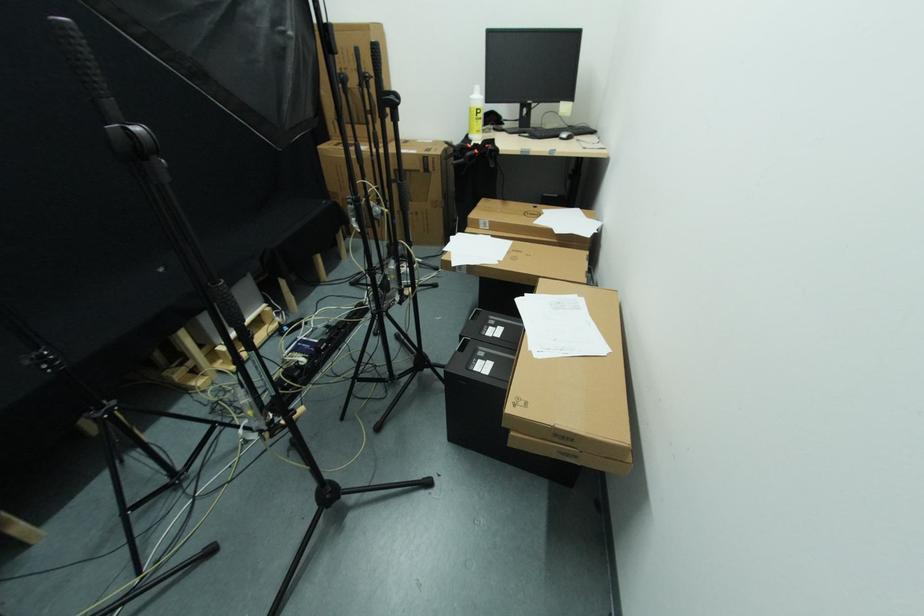
Where is `mic stand adjustment knob`? This screenshot has width=924, height=616. mic stand adjustment knob is located at coordinates [x=247, y=341].